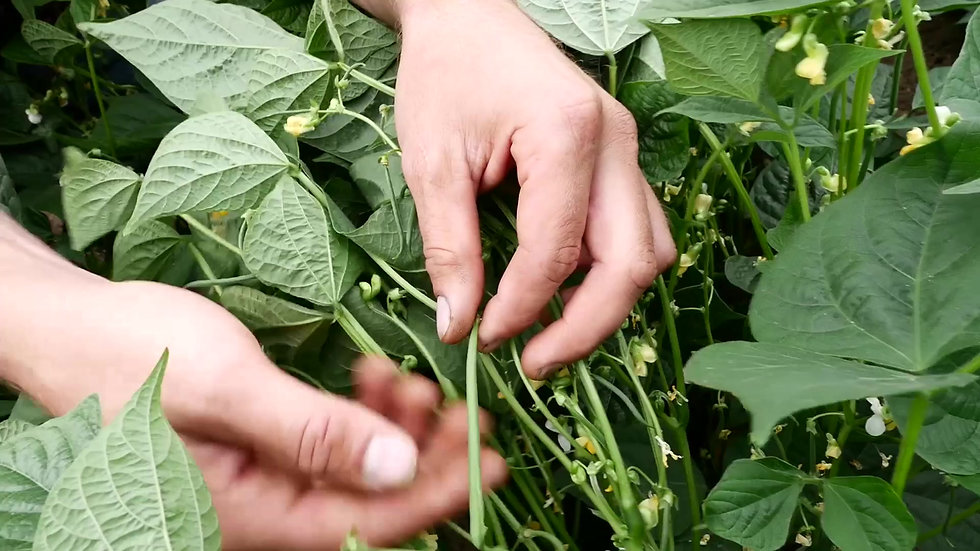
Find the location of `plant`. plant is located at coordinates (257, 67), (191, 210), (335, 241), (122, 488), (829, 329), (846, 86), (646, 25).